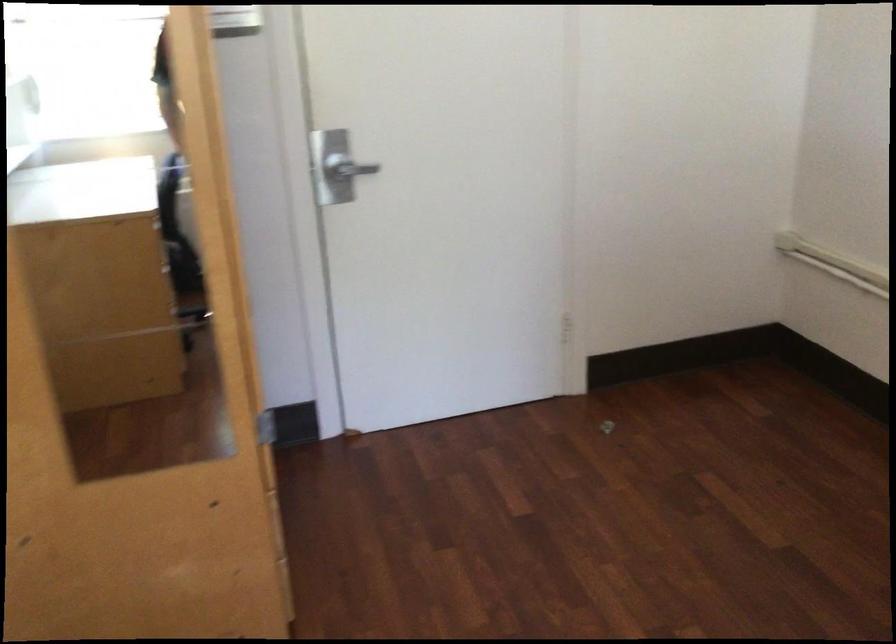
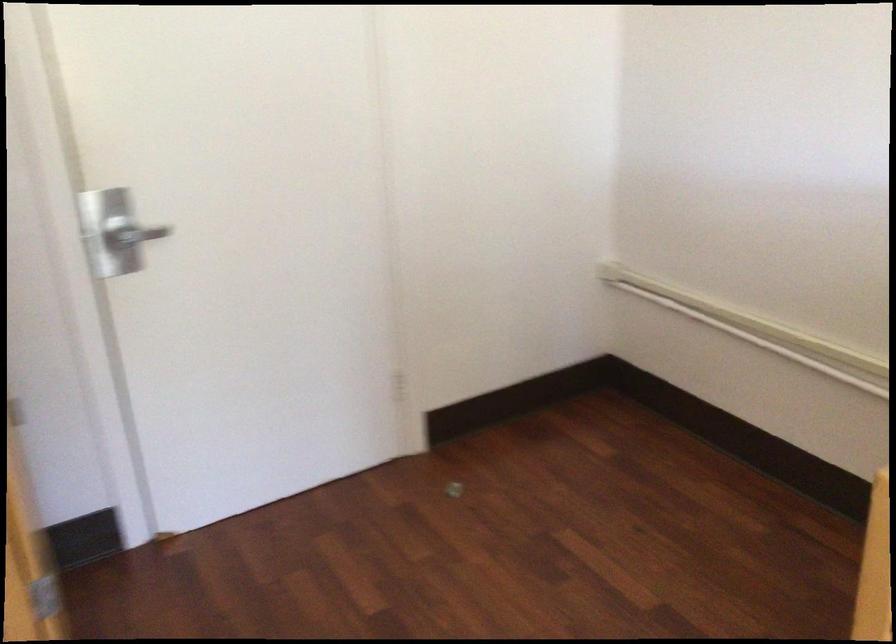
Locate, in the second image, the point that corresponds to point (348, 167) in the first image.

(133, 234)